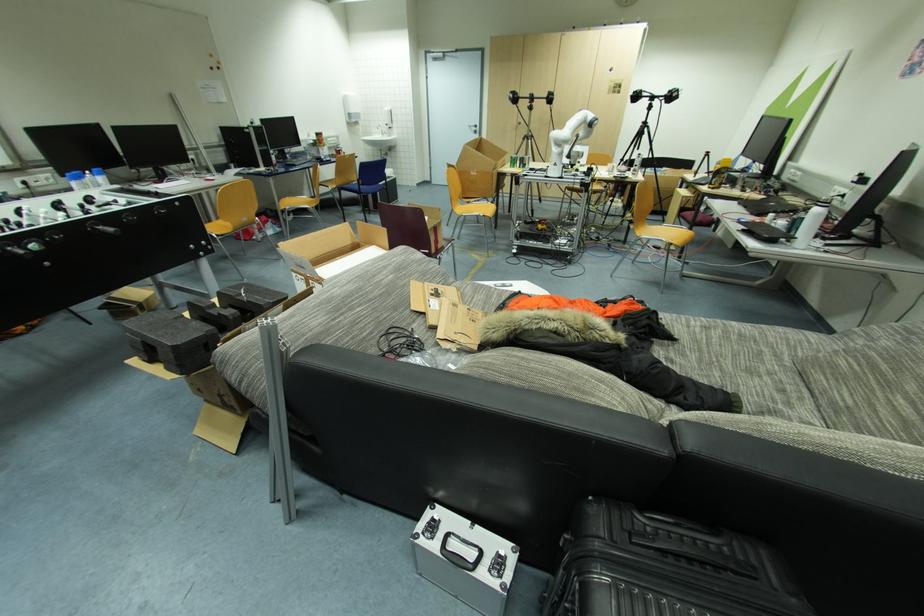
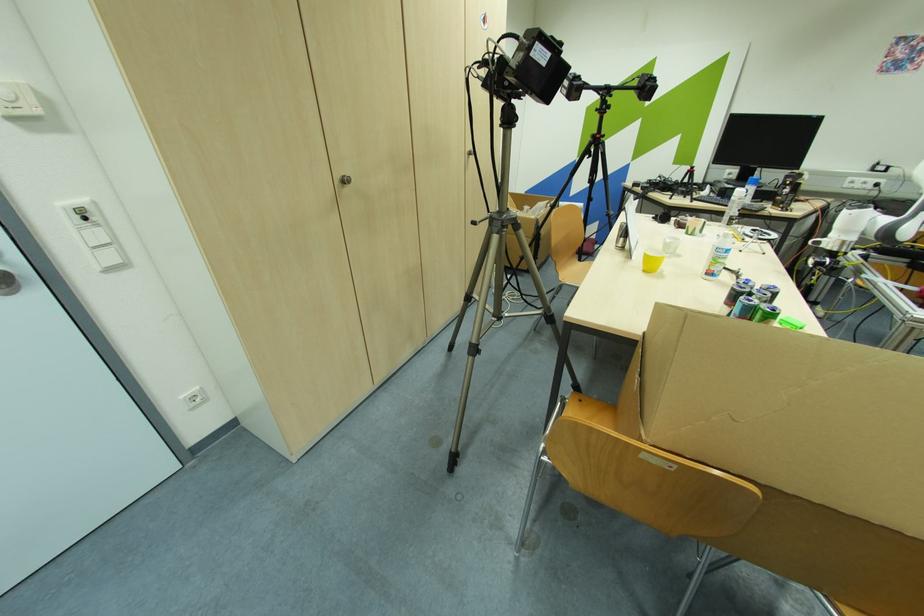
Where in the second image is the point corresponding to [530,136] from the first image?

(504, 214)